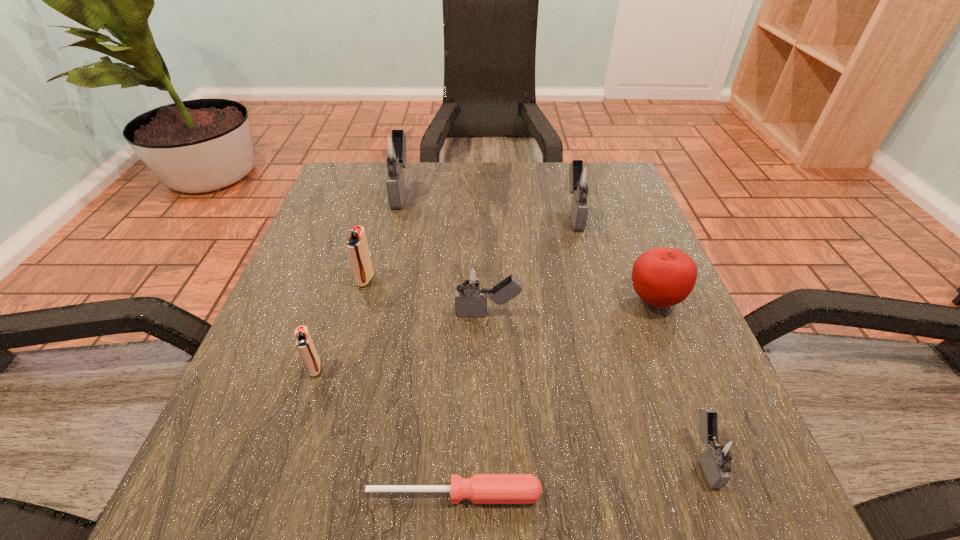
You are a GUI agent. You are given a task and a screenshot of the screen. Output one action in this format:
    pyautogui.click(x=<x>, y=<y>)
    Task: Click on the vacant area between the third igniter from right to left and the nearest igniter
    This screenshot has height=540, width=960.
    Given the screenshot: What is the action you would take?
    pyautogui.click(x=596, y=386)

Where is `vacant space that's between the apple and the rightmost gray igniter`? The width and height of the screenshot is (960, 540). vacant space that's between the apple and the rightmost gray igniter is located at coordinates (680, 379).

At what (x,y) coordinates should I click in order to perform the action: click on free space between the second igniter from right to left and the bigger red igniter. Please return your answer as a coordinate pair (x, y). The width and height of the screenshot is (960, 540). Looking at the image, I should click on (469, 247).

The width and height of the screenshot is (960, 540). I want to click on vacant region between the screwdriver and the third nearest igniter, so (471, 404).

Locate which object is the sixth closest to the nearest gray igniter. Please provide its 2D coordinates. Your answer should be formatted as a tuple, i.e. [(x, y)], where the tuple contains the x and y coordinates of a point satisfying the conditions above.

[(357, 247)]

Select which object appears as the sixth closest to the rightmost gray igniter. Please provide its 2D coordinates. Your answer should be formatted as a tuple, i.e. [(x, y)], where the tuple contains the x and y coordinates of a point satisfying the conditions above.

[(357, 247)]

Identify the location of igniter that stands as the second closest to the rightmost gray igniter. This screenshot has width=960, height=540. (583, 180).

Select which igniter appears as the fourth closest to the red apple. Please provide its 2D coordinates. Your answer should be formatted as a tuple, i.e. [(x, y)], where the tuple contains the x and y coordinates of a point satisfying the conditions above.

[(357, 247)]

At what (x,y) coordinates should I click in order to perform the action: click on gray igniter that is the third closest to the nearest gray igniter. Please return your answer as a coordinate pair (x, y). Looking at the image, I should click on (391, 148).

Locate an element on the screen. The image size is (960, 540). gray igniter that is the closest one to the second igniter from right to left is located at coordinates (471, 281).